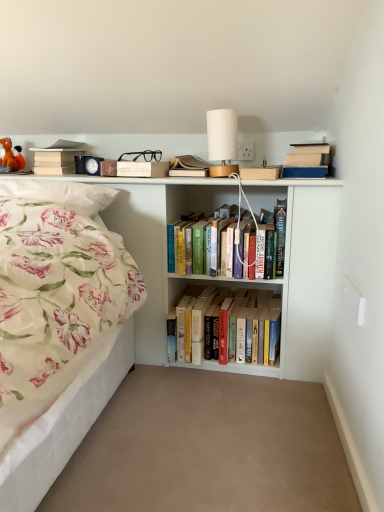
Question: Can you confirm if beige carpet at center is shorter than orange plush toy at upper left?

Choices:
 (A) yes
 (B) no

Answer: (A)

Question: Is beige carpet at center wider than orange plush toy at upper left?

Choices:
 (A) no
 (B) yes

Answer: (B)

Question: Does beige carpet at center have a lesser width compared to orange plush toy at upper left?

Choices:
 (A) yes
 (B) no

Answer: (B)

Question: Does beige carpet at center have a smaller size compared to orange plush toy at upper left?

Choices:
 (A) yes
 (B) no

Answer: (B)

Question: Is beige carpet at center to the right of orange plush toy at upper left from the viewer's perspective?

Choices:
 (A) no
 (B) yes

Answer: (B)

Question: From a real-world perspective, is beige carpet at center under orange plush toy at upper left?

Choices:
 (A) no
 (B) yes

Answer: (B)

Question: Considering the relative sizes of floral fabric pillow at left and hardcover books at center, which is the 2th book in bottom-to-top order, in the image provided, is floral fabric pillow at left smaller than hardcover books at center, which is the 2th book in bottom-to-top order,?

Choices:
 (A) no
 (B) yes

Answer: (B)

Question: Is floral fabric pillow at left in front of hardcover books at center, the first book in the right-to-left sequence?

Choices:
 (A) yes
 (B) no

Answer: (A)

Question: Does floral fabric pillow at left contain hardcover books at center, the 2th book in the top-to-bottom sequence?

Choices:
 (A) no
 (B) yes

Answer: (A)

Question: Is floral fabric pillow at left touching hardcover books at center, which is the 2th book in bottom-to-top order?

Choices:
 (A) no
 (B) yes

Answer: (A)

Question: Is floral fabric pillow at left to the left of hardcover books at center, which is the 2th book in bottom-to-top order, from the viewer's perspective?

Choices:
 (A) yes
 (B) no

Answer: (A)

Question: Can you confirm if floral fabric pillow at left is thinner than hardcover books at center, the 2th book in the top-to-bottom sequence?

Choices:
 (A) yes
 (B) no

Answer: (A)

Question: Can you confirm if matte brown book at upper center is positioned to the right of orange plush toy at upper left?

Choices:
 (A) yes
 (B) no

Answer: (A)